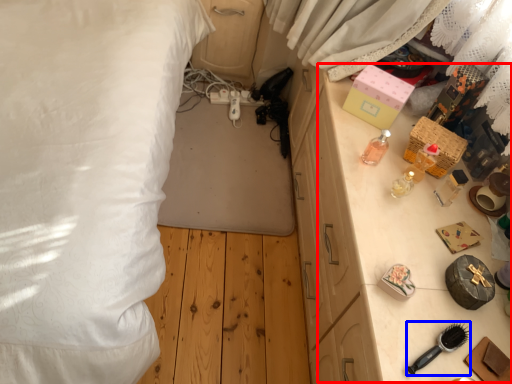
Question: Among these objects, which one is farthest to the camera, table (highlighted by a red box) or brush (highlighted by a blue box)?

Choices:
 (A) table
 (B) brush

Answer: (A)